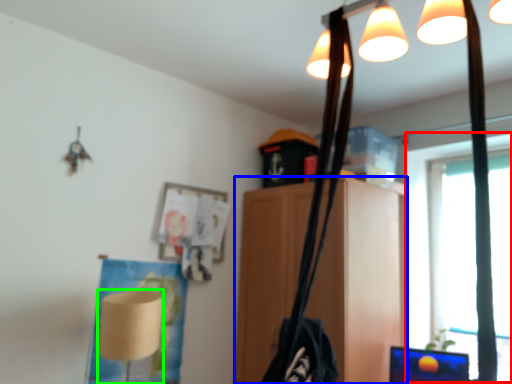
Question: Estimate the real-world distances between objects in this image. Which object is farther from window screen (highlighted by a red box), furniture (highlighted by a blue box) or lamp (highlighted by a green box)?

Choices:
 (A) furniture
 (B) lamp

Answer: (B)